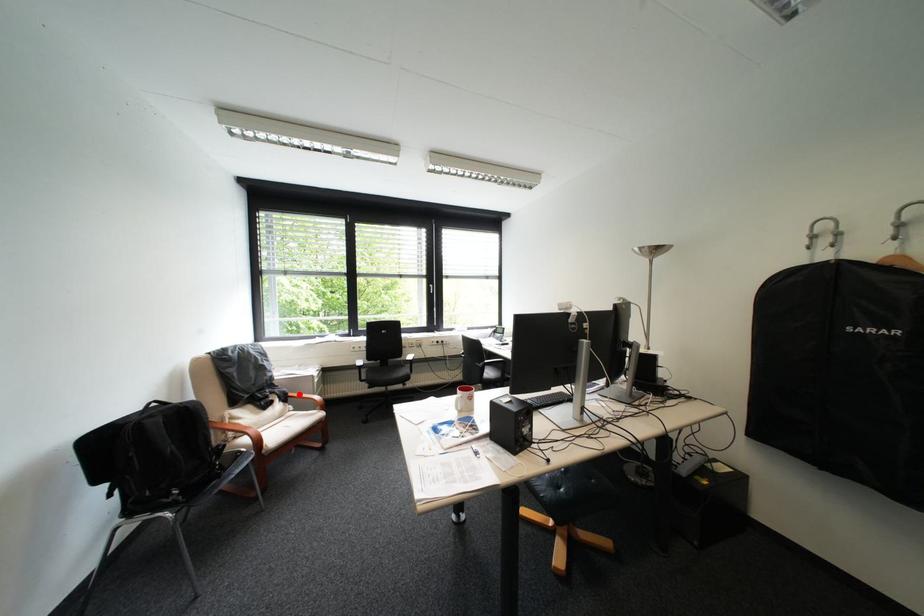
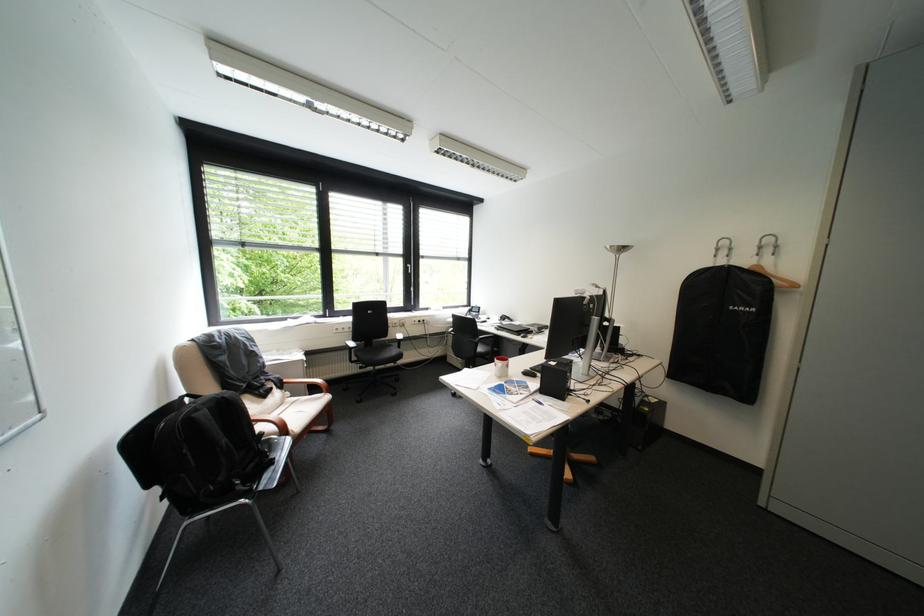
Question: I am providing you with two images of the same scene from different viewpoints. A red point is marked on the first image. Can you still see the location of the red point in image 2?

Choices:
 (A) Yes
 (B) No

Answer: (A)